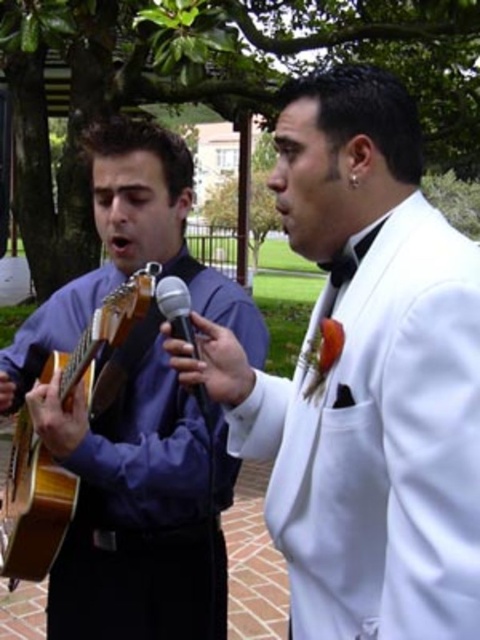
Is the position of matte purple shirt at left more distant than that of wooden acoustic guitar at left?

Yes, it is behind wooden acoustic guitar at left.

Can you confirm if matte purple shirt at left is wider than wooden acoustic guitar at left?

Yes.

Between point (111, 515) and point (3, 547), which one is positioned in front?

Point (111, 515) is in front.

You are a GUI agent. You are given a task and a screenshot of the screen. Output one action in this format:
    pyautogui.click(x=<x>, y=<y>)
    Task: Click on the matte purple shirt at left
    The height and width of the screenshot is (640, 480).
    Given the screenshot: What is the action you would take?
    pyautogui.click(x=131, y=408)

Can you confirm if white satin suit at right is wider than wooden acoustic guitar at left?

Indeed, white satin suit at right has a greater width compared to wooden acoustic guitar at left.

Is white satin suit at right above wooden acoustic guitar at left?

Correct, white satin suit at right is located above wooden acoustic guitar at left.

Describe the element at coordinates (364, 378) in the screenshot. Image resolution: width=480 pixels, height=640 pixels. I see `white satin suit at right` at that location.

Where is `white satin suit at right`? The image size is (480, 640). white satin suit at right is located at coordinates (364, 378).

Does white satin suit at right have a smaller size compared to black metallic microphone at center?

No, white satin suit at right is not smaller than black metallic microphone at center.

Can you confirm if white satin suit at right is shorter than black metallic microphone at center?

In fact, white satin suit at right may be taller than black metallic microphone at center.

Is point (472, 388) farther from camera compared to point (181, 320)?

No, (472, 388) is in front of (181, 320).

In order to click on white satin suit at right in this screenshot , I will do `click(364, 378)`.